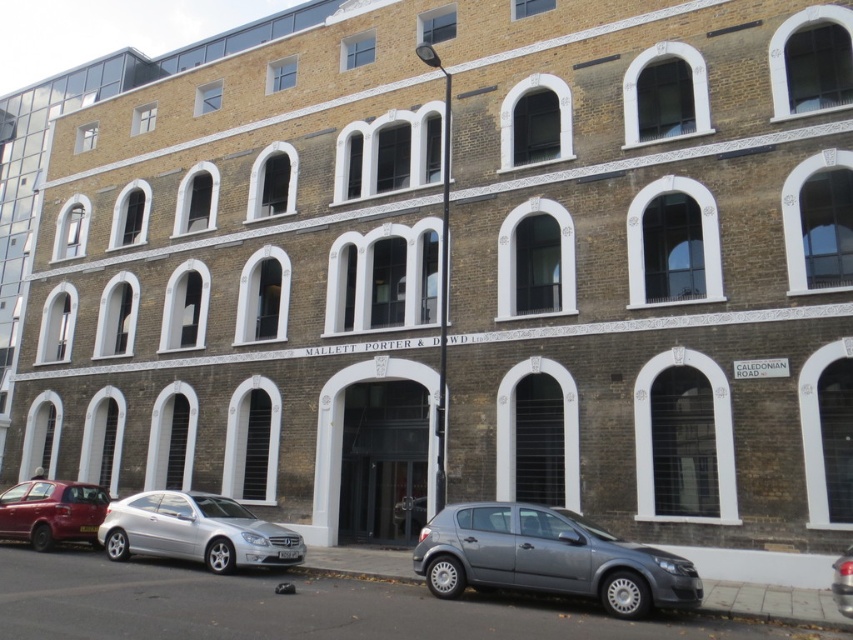
Is matte red car at lower left thinner than metallic silver car at lower right?

Incorrect, matte red car at lower left's width is not less than metallic silver car at lower right's.

Can you confirm if matte red car at lower left is smaller than metallic silver car at lower right?

No.

Describe the element at coordinates (51, 513) in the screenshot. I see `matte red car at lower left` at that location.

You are a GUI agent. You are given a task and a screenshot of the screen. Output one action in this format:
    pyautogui.click(x=<x>, y=<y>)
    Task: Click on the matte red car at lower left
    This screenshot has width=853, height=640.
    Given the screenshot: What is the action you would take?
    pyautogui.click(x=51, y=513)

Who is positioned more to the left, satin silver car at lower center or silver metallic car at lower left?

silver metallic car at lower left

Is point (657, 593) farther from camera compared to point (109, 541)?

No, it is not.

The width and height of the screenshot is (853, 640). In order to click on satin silver car at lower center in this screenshot , I will do [548, 557].

Looking at this image, which is above, silver metallic car at lower left or matte red car at lower left?

silver metallic car at lower left is above.

Between silver metallic car at lower left and matte red car at lower left, which one is positioned lower?

matte red car at lower left is lower down.

Is point (148, 499) farther from camera compared to point (22, 534)?

No, (148, 499) is in front of (22, 534).

This screenshot has height=640, width=853. What are the coordinates of `silver metallic car at lower left` in the screenshot? It's located at 196,531.